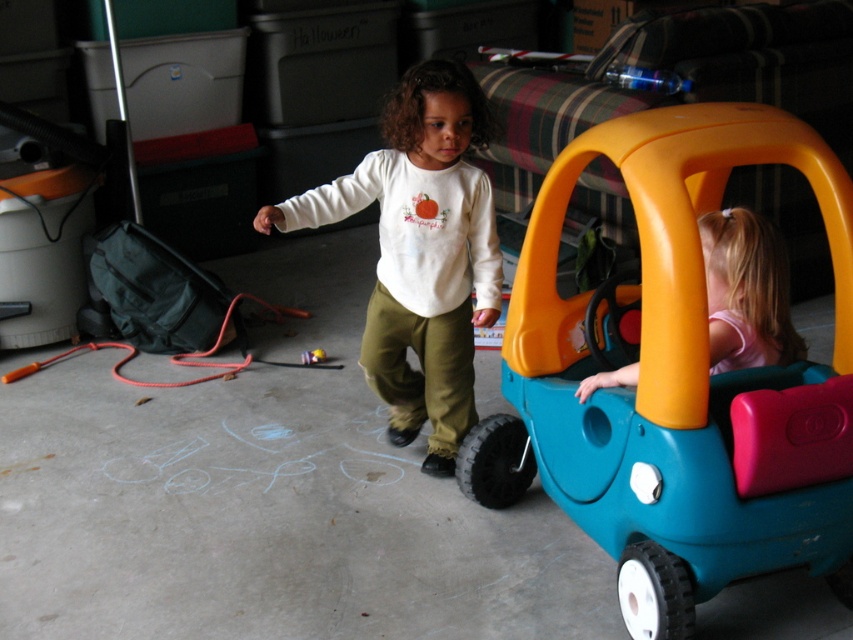
Question: Can you confirm if blue plastic toy car at center is positioned below smooth plastic toy car at center?

Choices:
 (A) yes
 (B) no

Answer: (B)

Question: Among these points, which one is farthest from the camera?

Choices:
 (A) (769, 282)
 (B) (314, 352)
 (C) (430, 253)

Answer: (B)

Question: Does white cotton shirt at center have a lesser width compared to smooth plastic toy car at center?

Choices:
 (A) no
 (B) yes

Answer: (A)

Question: Estimate the real-world distances between objects in this image. Which object is closer to the blue plastic toy car at center?

Choices:
 (A) pink matte car seat at right
 (B) white cotton shirt at center

Answer: (A)

Question: Does pink matte car seat at right have a larger size compared to smooth plastic toy car at center?

Choices:
 (A) no
 (B) yes

Answer: (B)

Question: Which point appears farthest from the camera in this image?

Choices:
 (A) (323, 355)
 (B) (477, 99)

Answer: (A)